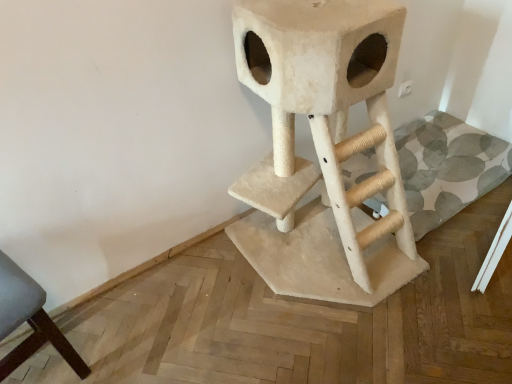
Question: In terms of height, does dark gray fabric chair at lower left look taller or shorter compared to beige carpeted cat tree at center?

Choices:
 (A) tall
 (B) short

Answer: (B)

Question: Is point (2, 291) closer or farther from the camera than point (330, 157)?

Choices:
 (A) closer
 (B) farther

Answer: (A)

Question: Is dark gray fabric chair at lower left wider or thinner than beige carpeted cat tree at center?

Choices:
 (A) thin
 (B) wide

Answer: (A)

Question: Is beige carpeted cat tree at center to the left or to the right of dark gray fabric chair at lower left in the image?

Choices:
 (A) right
 (B) left

Answer: (A)

Question: Is beige carpeted cat tree at center spatially inside dark gray fabric chair at lower left, or outside of it?

Choices:
 (A) inside
 (B) outside

Answer: (B)

Question: Is point (371, 112) closer or farther from the camera than point (84, 364)?

Choices:
 (A) closer
 (B) farther

Answer: (B)

Question: Is beige carpeted cat tree at center in front of or behind dark gray fabric chair at lower left in the image?

Choices:
 (A) behind
 (B) front

Answer: (B)